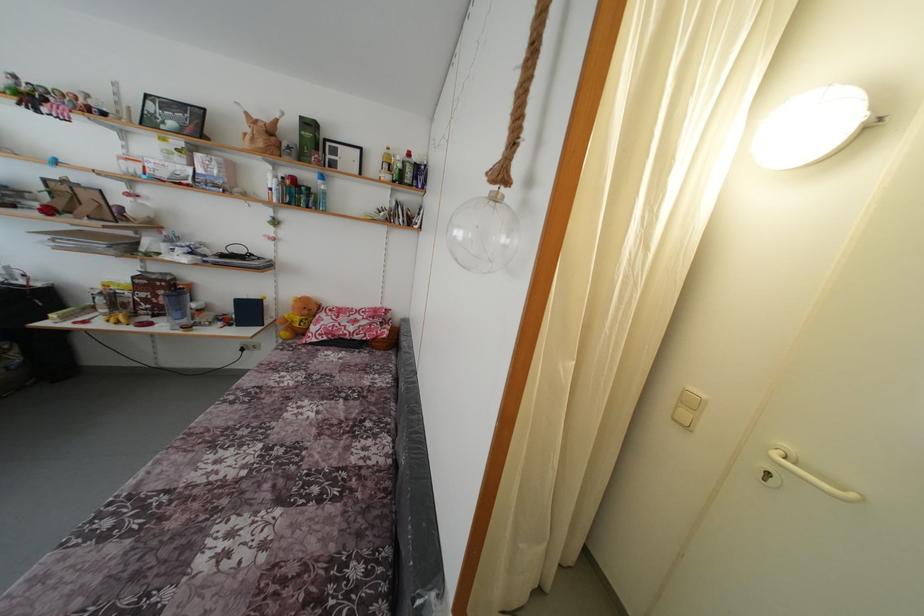
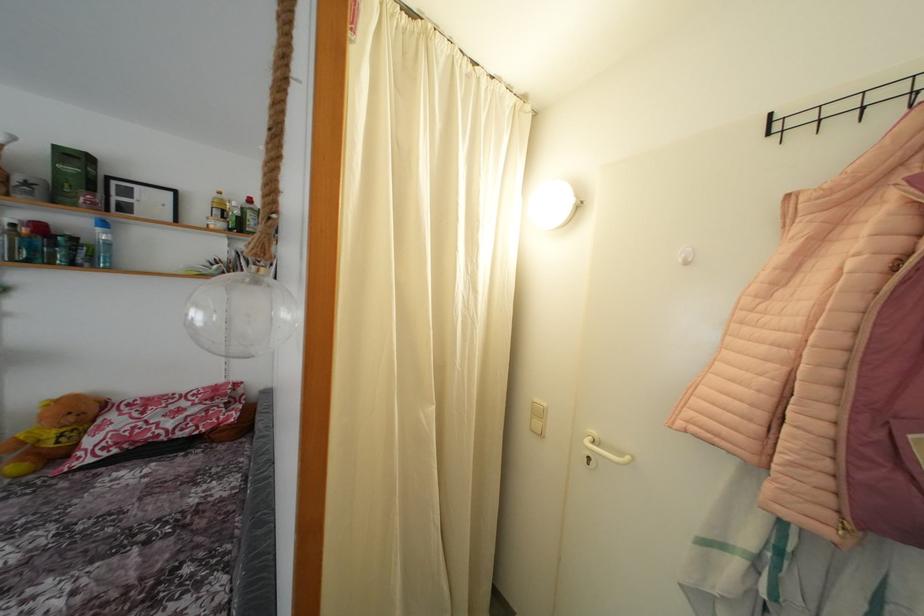
Find the pixel in the second image that matches the point at 393,155 in the first image.

(225, 199)